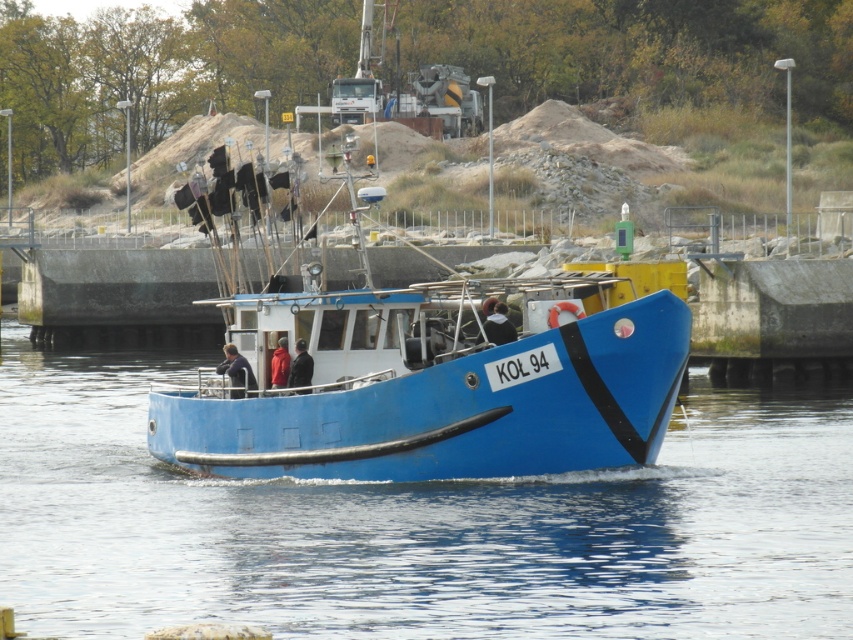
You are a photographer trying to capture the blue rubber boat at center and the blue matte boat at center in the same frame. Which boat should you focus on first to ensure both are in focus?

You should focus on the blue rubber boat at center first because it is closer to the viewer, so adjusting focus from near to far will help both boats be in focus.

You are a sailor on the blue rubber boat at center and want to move towards the blue matte boat at center. Which direction should you steer your boat to reach it?

The blue rubber boat at center is to the left of the blue matte boat at center, so you should steer your boat to the right to reach the blue matte boat at center.

You are standing on the deck of the blue fishing boat named KO? 94 and want to reach the concrete pier in the background. The point you need to reach is located at coordinates point (527, 618). Can you estimate how far this point is from your current position?

The distance between point (527, 618) and the camera is 34.44 meters, so the point is 34.44 meters away from your current position on the boat.